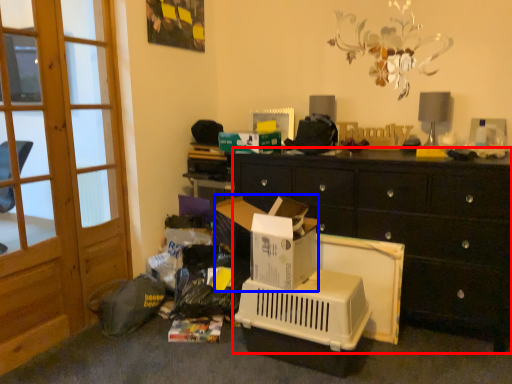
Question: Among these objects, which one is nearest to the camera, cabinetry (highlighted by a red box) or cardboard box (highlighted by a blue box)?

Choices:
 (A) cabinetry
 (B) cardboard box

Answer: (A)